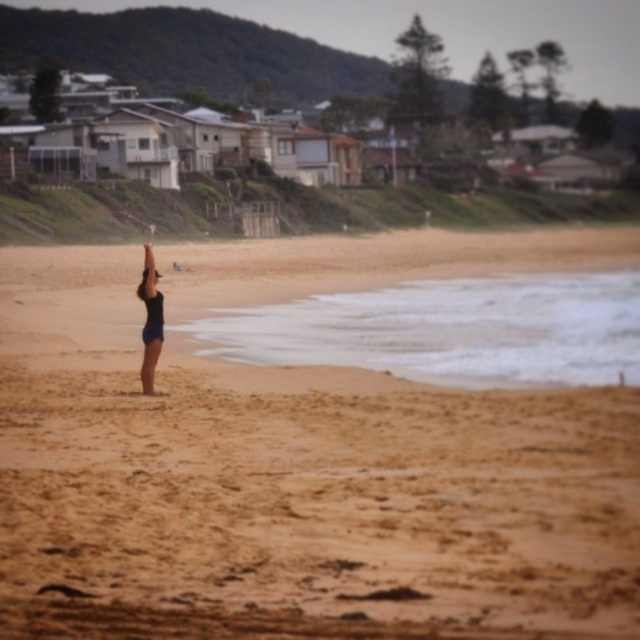
From the picture: Which is below, brown sandy beach at center or black matte swimsuit at center?

Positioned lower is brown sandy beach at center.

Is brown sandy beach at center shorter than black matte swimsuit at center?

Yes.

Find the location of `brown sandy beach at center`. brown sandy beach at center is located at coordinates (291, 486).

Where is `brown sandy beach at center`? Image resolution: width=640 pixels, height=640 pixels. brown sandy beach at center is located at coordinates (291, 486).